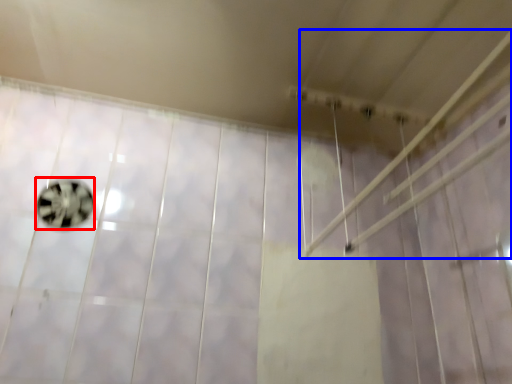
Question: Which object is closer to the camera taking this photo, ball (highlighted by a red box) or shower (highlighted by a blue box)?

Choices:
 (A) ball
 (B) shower

Answer: (B)